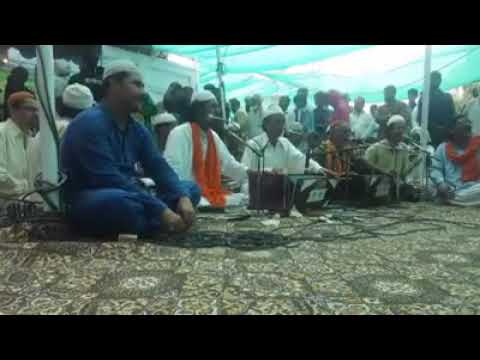
Identify the location of patterned carpet. (323, 267).